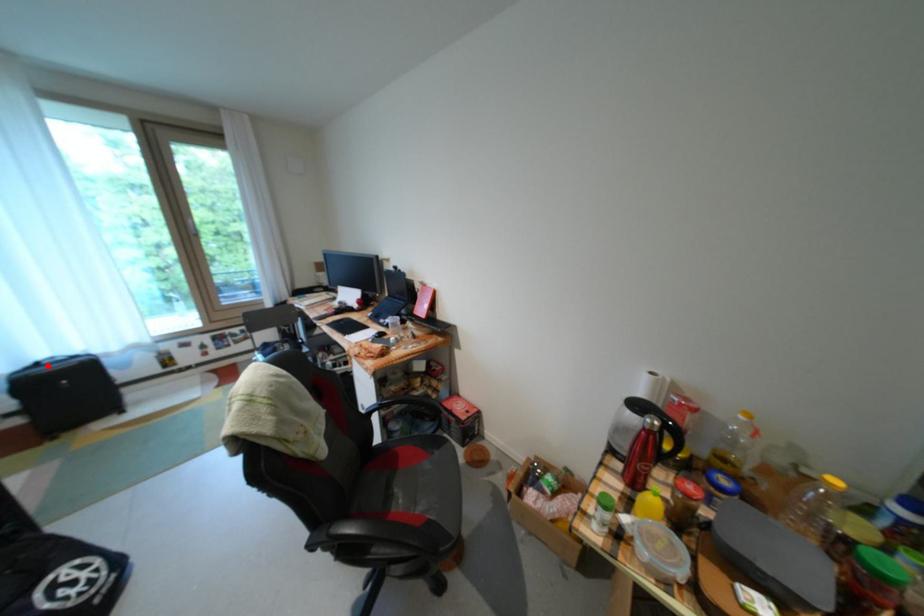
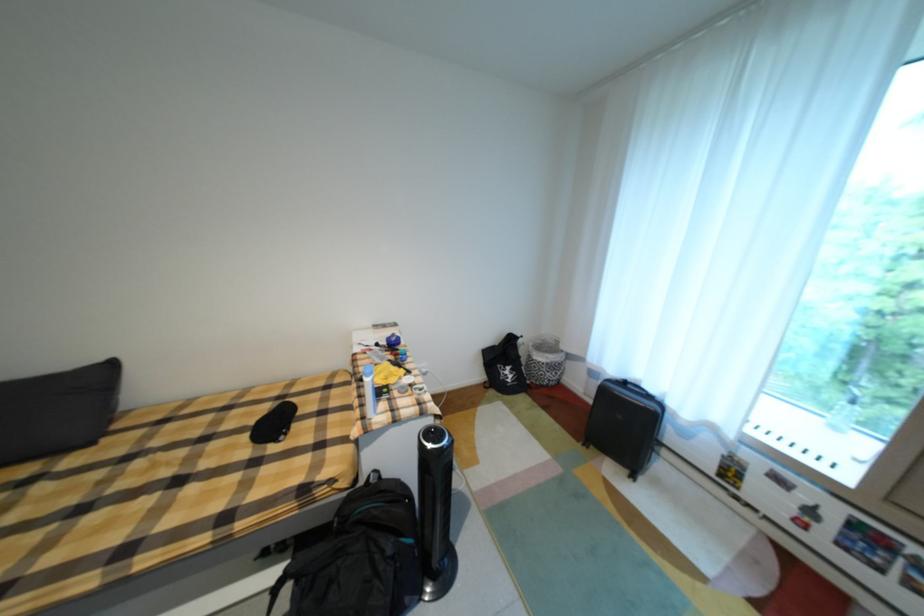
The point at the highlighted location is marked in the first image. Where is the corresponding point in the second image?

(635, 384)